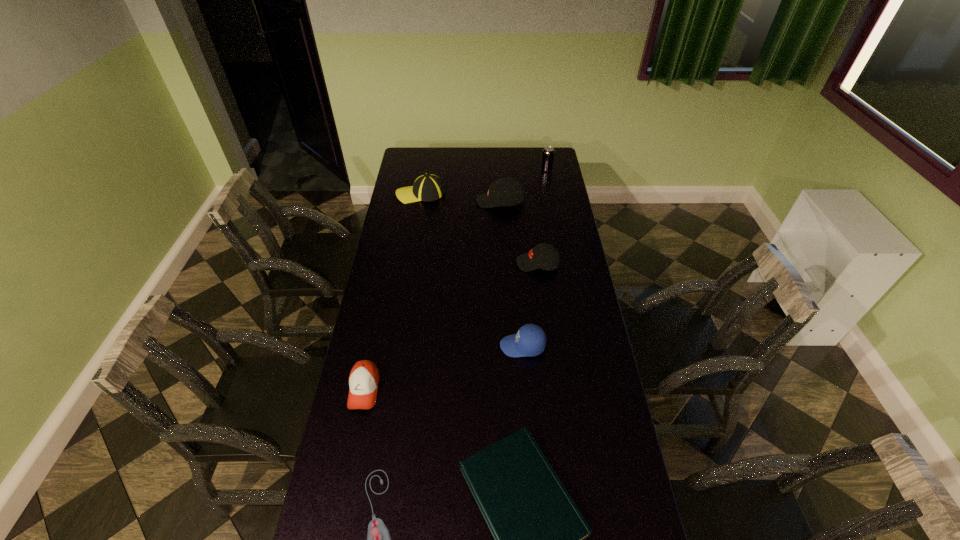
The width and height of the screenshot is (960, 540). I want to click on free space located 0.130m on the front-facing side of the fourth nearest object, so click(x=466, y=346).

The height and width of the screenshot is (540, 960). In order to click on free space located 0.280m on the front-facing side of the nearest baseball cap in this screenshot , I will do `click(341, 504)`.

What are the coordinates of `object that is at the far edge` in the screenshot? It's located at (548, 153).

Where is `soda can positioned at the right edge`? soda can positioned at the right edge is located at coordinates (548, 153).

I want to click on baseball cap that is at the right edge, so click(x=544, y=256).

Where is `object that is at the far right corner`? object that is at the far right corner is located at coordinates (548, 153).

At what (x,y) coordinates should I click in order to perform the action: click on vacant point at the far edge. Please return your answer as a coordinate pair (x, y). The width and height of the screenshot is (960, 540). Looking at the image, I should click on (471, 152).

In the image, there is a desktop. At what (x,y) coordinates should I click in order to perform the action: click on blank space at the left edge. Please return your answer as a coordinate pair (x, y). Looking at the image, I should click on (391, 245).

Locate an element on the screen. The width and height of the screenshot is (960, 540). vacant position at the right edge of the desktop is located at coordinates (620, 429).

You are a GUI agent. You are given a task and a screenshot of the screen. Output one action in this format:
    pyautogui.click(x=<x>, y=<y>)
    Task: Click on the vacant space that's between the farthest object and the fifth nearest object
    This screenshot has height=540, width=960.
    Given the screenshot: What is the action you would take?
    pyautogui.click(x=542, y=217)